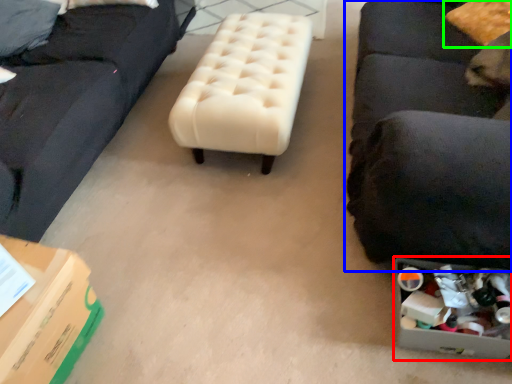
Question: Which object is positioned closest to storage box (highlighted by a red box)? Select from studio couch (highlighted by a blue box) and pillow (highlighted by a green box).

Choices:
 (A) studio couch
 (B) pillow

Answer: (A)